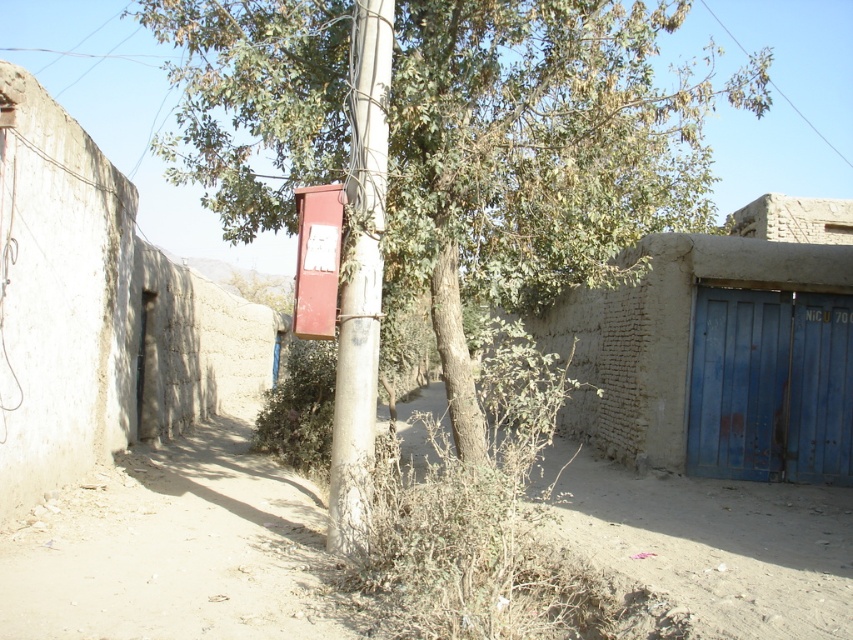
You are standing at the point marked as point (721, 348) in the alleyway. What structure can you see directly in front of you?

The blue mud hut at right is located at point 0.546, 0.846, so you can see the blue mud hut at right directly in front of you.

You are a delivery person trying to navigate through the narrow alleyway. You see the concrete pole at center and the metallic red phone box at center. Which object is taller and could potentially block your delivery vehicle if it is taller than 3 meters?

The concrete pole at center is taller than the metallic red phone box at center. If the concrete pole at center is taller than 3 meters, it could potentially block your delivery vehicle.